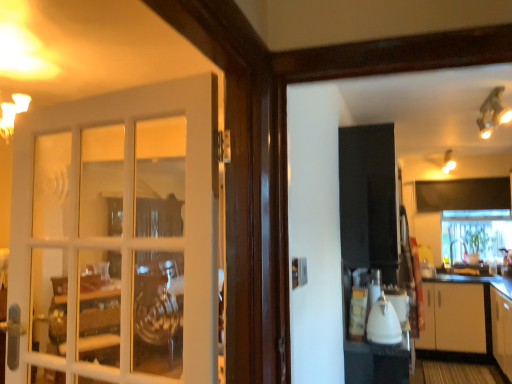
Describe the element at coordinates (476, 281) in the screenshot. I see `white glossy countertop at right` at that location.

The width and height of the screenshot is (512, 384). What do you see at coordinates (475, 234) in the screenshot? I see `clear glass window at center` at bounding box center [475, 234].

This screenshot has height=384, width=512. I want to click on white glass door at left, so click(118, 237).

Consider the image. Measure the distance between white glass door at left and camera.

white glass door at left and camera are 3.30 feet apart.

The height and width of the screenshot is (384, 512). What do you see at coordinates (383, 319) in the screenshot?
I see `white glossy kettle at center` at bounding box center [383, 319].

What are the coordinates of `white glossy countertop at right` in the screenshot? It's located at (476, 281).

In the image, there is a white glass door at left. Where is `window frame below it (from a real-world perspective)`? window frame below it (from a real-world perspective) is located at coordinates (475, 234).

From a real-world perspective, which is physically above, clear glass window at center or white glass door at left?

white glass door at left.

Consider the image. Who is taller, clear glass window at center or white glass door at left?

white glass door at left is taller.

From the image's perspective, is clear glass window at center under white glass door at left?

Correct, clear glass window at center appears lower than white glass door at left in the image.

This screenshot has height=384, width=512. What are the coordinates of `window frame lying above the white glossy cabinet at lower right (from the image's perspective)` in the screenshot? It's located at (475, 234).

Considering the relative sizes of white glossy cabinet at lower right and clear glass window at center in the image provided, is white glossy cabinet at lower right thinner than clear glass window at center?

Indeed, white glossy cabinet at lower right has a lesser width compared to clear glass window at center.

Would you say clear glass window at center is part of white glossy cabinet at lower right's contents?

Actually, clear glass window at center is outside white glossy cabinet at lower right.

Looking at the image, does white glossy cabinet at lower right seem bigger or smaller compared to clear glass window at center?

white glossy cabinet at lower right is bigger than clear glass window at center.

Between white glass door at left and white glossy kettle at center, which one has less height?

white glossy kettle at center is shorter.

Can you tell me how much white glass door at left and white glossy kettle at center differ in facing direction?

The facing directions of white glass door at left and white glossy kettle at center are 98.8 degrees apart.

Would you say white glass door at left is outside white glossy kettle at center?

Yes, white glass door at left is outside of white glossy kettle at center.

Does white glass door at left have a lesser width compared to white glossy kettle at center?

Yes, white glass door at left is thinner than white glossy kettle at center.

Is white glossy kettle at center shorter than white glass door at left?

Correct, white glossy kettle at center is not as tall as white glass door at left.

From a real-world perspective, is white glossy kettle at center positioned above or below white glass door at left?

Clearly, from a real-world perspective, white glossy kettle at center is below white glass door at left.

Considering the relative sizes of white glossy kettle at center and white glass door at left in the image provided, is white glossy kettle at center thinner than white glass door at left?

Incorrect, the width of white glossy kettle at center is not less than that of white glass door at left.

In order to click on door above the white glossy kettle at center (from a real-world perspective) in this screenshot , I will do `click(118, 237)`.

Is white glossy kettle at center not near clear glass window at center?

Indeed, white glossy kettle at center is not near clear glass window at center.

Is white glossy kettle at center looking in the opposite direction of clear glass window at center?

That's not correct — white glossy kettle at center is not looking away from clear glass window at center.

Does point (391, 334) come closer to viewer compared to point (473, 224)?

Yes.

Can we say white glossy kettle at center lies outside clear glass window at center?

That's correct, white glossy kettle at center is outside of clear glass window at center.

Considering the sizes of white glossy countertop at right and white glossy kettle at center in the image, is white glossy countertop at right taller or shorter than white glossy kettle at center?

Considering their sizes, white glossy countertop at right has less height than white glossy kettle at center.

Is white glossy countertop at right spatially inside white glossy kettle at center, or outside of it?

white glossy countertop at right cannot be found inside white glossy kettle at center.

Locate an element on the screen. counter top located below the white glossy kettle at center (from the image's perspective) is located at coordinates (476, 281).

From a real-world perspective, is white glass door at left over white glossy countertop at right?

Indeed, from a real-world perspective, white glass door at left stands above white glossy countertop at right.

Which object is closer to the camera taking this photo, white glass door at left or white glossy countertop at right?

white glass door at left is in front.

Is point (102, 234) less distant than point (467, 280)?

No, (102, 234) is further to viewer.

Where is `window frame beneath the white glass door at left (from a real-world perspective)`? window frame beneath the white glass door at left (from a real-world perspective) is located at coordinates (475, 234).

At what (x,y) coordinates should I click in order to perform the action: click on cabinetry below the clear glass window at center (from the image's perspective). Please return your answer as a coordinate pair (x, y). Image resolution: width=512 pixels, height=384 pixels. Looking at the image, I should click on (502, 330).

Looking at the image, which one is located closer to clear glass window at center, white glass door at left or white glossy kettle at center?

Based on the image, white glossy kettle at center appears to be nearer to clear glass window at center.

In the scene shown: From the image, which object appears to be farther from white glossy cabinet at lower right, white glossy kettle at center or white glossy countertop at right?

Among the two, white glossy kettle at center is located further to white glossy cabinet at lower right.

Looking at the image, which one is located closer to white glossy cabinet at lower right, white glossy countertop at right or white glass door at left?

Based on the image, white glossy countertop at right appears to be nearer to white glossy cabinet at lower right.

Which object lies nearer to the anchor point white glass door at left, clear glass window at center or white glossy cabinet at lower right?

white glossy cabinet at lower right is positioned closer to the anchor white glass door at left.

Considering their positions, is white glossy cabinet at lower right positioned further to white glossy kettle at center than white glossy countertop at right?

Among the two, white glossy countertop at right is located further to white glossy kettle at center.

Considering their positions, is white glass door at left positioned closer to white glossy countertop at right than clear glass window at center?

Based on the image, clear glass window at center appears to be nearer to white glossy countertop at right.

Consider the image. Estimate the real-world distances between objects in this image. Which object is closer to clear glass window at center, white glass door at left or white glossy countertop at right?

white glossy countertop at right is positioned closer to the anchor clear glass window at center.

Estimate the real-world distances between objects in this image. Which object is closer to white glossy kettle at center, white glossy cabinet at lower right or white glass door at left?

The object closer to white glossy kettle at center is white glass door at left.

Find the location of a particular element. appliance between white glass door at left and clear glass window at center from front to back is located at coordinates (383, 319).

The height and width of the screenshot is (384, 512). Find the location of `cabinetry between white glass door at left and white glossy countertop at right in the front-back direction`. cabinetry between white glass door at left and white glossy countertop at right in the front-back direction is located at coordinates (502, 330).

Find the location of a particular element. This screenshot has width=512, height=384. counter top between white glass door at left and clear glass window at center from front to back is located at coordinates (476, 281).

This screenshot has width=512, height=384. I want to click on cabinetry between white glossy kettle at center and white glossy countertop at right from front to back, so pos(502,330).